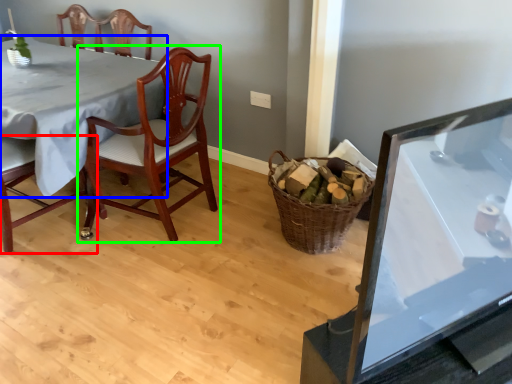
Question: Estimate the real-world distances between objects in this image. Which object is closer to chair (highlighted by a red box), table (highlighted by a blue box) or chair (highlighted by a green box)?

Choices:
 (A) table
 (B) chair

Answer: (A)